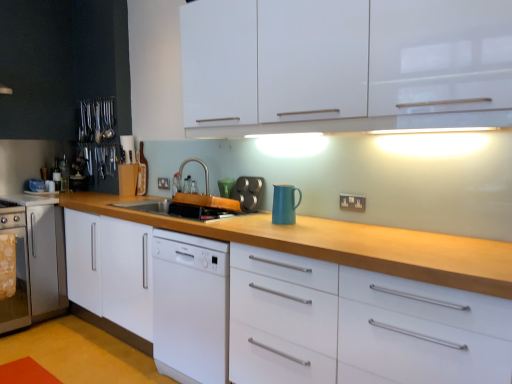
Identify the location of glossy ceramic pitcher at upper center. (284, 204).

Where is `white glossy cabinet at upper center`? white glossy cabinet at upper center is located at coordinates (344, 65).

Which object is more forward, glossy ceramic pitcher at upper center or white glossy cabinet at upper center?

Positioned in front is white glossy cabinet at upper center.

How different are the orientations of glossy ceramic pitcher at upper center and white glossy cabinet at upper center in degrees?

The angle between the facing direction of glossy ceramic pitcher at upper center and the facing direction of white glossy cabinet at upper center is 3.81 degrees.

Based on the photo, is glossy ceramic pitcher at upper center to the right of white glossy cabinet at upper center from the viewer's perspective?

No.

The width and height of the screenshot is (512, 384). Identify the location of cabinetry on the right of glossy ceramic pitcher at upper center. (x=344, y=65).

Based on the photo, is silver metallic faucet at center turned away from black plastic electrical outlet at center-right, which appears as the 2th electric outlet when viewed from the top?

No, black plastic electrical outlet at center-right, which appears as the 2th electric outlet when viewed from the top, is not at the back of silver metallic faucet at center.

Can you confirm if silver metallic faucet at center is wider than black plastic electrical outlet at center-right, which is counted as the 1th electric outlet, starting from the front?

Indeed, silver metallic faucet at center has a greater width compared to black plastic electrical outlet at center-right, which is counted as the 1th electric outlet, starting from the front.

Where is `tap located above the black plastic electrical outlet at center-right, acting as the first electric outlet starting from the right (from a real-world perspective)`? tap located above the black plastic electrical outlet at center-right, acting as the first electric outlet starting from the right (from a real-world perspective) is located at coordinates tap(203, 167).

Is silver metallic faucet at center bigger or smaller than black plastic electrical outlet at center-right, which appears as the 2th electric outlet when viewed from the top?

In the image, silver metallic faucet at center appears to be larger than black plastic electrical outlet at center-right, which appears as the 2th electric outlet when viewed from the top.

How many degrees apart are the facing directions of metallic silver muffin tin at center, acting as the second appliance starting from the left, and glossy ceramic pitcher at upper center?

metallic silver muffin tin at center, acting as the second appliance starting from the left, and glossy ceramic pitcher at upper center are facing 0.000119 degrees away from each other.

From the image's perspective, would you say metallic silver muffin tin at center, which is the first appliance in front-to-back order, is positioned over glossy ceramic pitcher at upper center?

Yes, from the image's perspective, metallic silver muffin tin at center, which is the first appliance in front-to-back order, is over glossy ceramic pitcher at upper center.

Looking at this image, considering the relative positions of metallic silver muffin tin at center, acting as the second appliance starting from the left, and glossy ceramic pitcher at upper center in the image provided, is metallic silver muffin tin at center, acting as the second appliance starting from the left, to the left or to the right of glossy ceramic pitcher at upper center?

Clearly, metallic silver muffin tin at center, acting as the second appliance starting from the left, is on the left of glossy ceramic pitcher at upper center in the image.

Is glossy ceramic pitcher at upper center at the back of metallic silver muffin tin at center, acting as the second appliance starting from the left?

No, metallic silver muffin tin at center, acting as the second appliance starting from the left,'s orientation is not away from glossy ceramic pitcher at upper center.

Considering the positions of objects silver metallic faucet at center and stainless steel oven at left, the 2th appliance in the right-to-left sequence, in the image provided, who is behind, silver metallic faucet at center or stainless steel oven at left, the 2th appliance in the right-to-left sequence,?

stainless steel oven at left, the 2th appliance in the right-to-left sequence, is behind.

Who is bigger, silver metallic faucet at center or stainless steel oven at left, the 2th appliance in the right-to-left sequence?

With larger size is stainless steel oven at left, the 2th appliance in the right-to-left sequence.

Is there a large distance between silver metallic faucet at center and stainless steel oven at left, arranged as the 2th appliance when viewed from the front?

Yes, silver metallic faucet at center is far from stainless steel oven at left, arranged as the 2th appliance when viewed from the front.

How many degrees apart are the facing directions of silver metallic faucet at center and stainless steel oven at left, arranged as the first appliance when viewed from the back?

93.8 degrees separate the facing orientations of silver metallic faucet at center and stainless steel oven at left, arranged as the first appliance when viewed from the back.

Does black plastic electric outlet at center, which is the 2th electric outlet from bottom to top, contain white glossy cabinet at upper center?

No, white glossy cabinet at upper center is not a part of black plastic electric outlet at center, which is the 2th electric outlet from bottom to top.

Is point (162, 184) positioned before point (342, 16)?

No, (162, 184) is further to viewer.

From the image's perspective, does black plastic electric outlet at center, the second electric outlet positioned from the right, appear lower than white glossy cabinet at upper center?

Yes, from the image's perspective, black plastic electric outlet at center, the second electric outlet positioned from the right, is below white glossy cabinet at upper center.

Does point (244, 189) appear closer or farther from the camera than point (169, 185)?

Point (244, 189) appears to be closer to the viewer than point (169, 185).

Is metallic silver muffin tin at center, acting as the second appliance starting from the left, positioned with its back to black plastic electric outlet at center, which ranks as the second electric outlet in front-to-back order?

metallic silver muffin tin at center, acting as the second appliance starting from the left, does not have its back to black plastic electric outlet at center, which ranks as the second electric outlet in front-to-back order.

Considering the sizes of metallic silver muffin tin at center, the 1th appliance viewed from the right, and black plastic electric outlet at center, which ranks as the first electric outlet in left-to-right order, in the image, is metallic silver muffin tin at center, the 1th appliance viewed from the right, bigger or smaller than black plastic electric outlet at center, which ranks as the first electric outlet in left-to-right order,?

metallic silver muffin tin at center, the 1th appliance viewed from the right, is bigger than black plastic electric outlet at center, which ranks as the first electric outlet in left-to-right order.

From the image's perspective, is metallic silver muffin tin at center, the 1th appliance viewed from the right, positioned above or below black plastic electric outlet at center, the second electric outlet positioned from the right?

Clearly, from the image's perspective, metallic silver muffin tin at center, the 1th appliance viewed from the right, is below black plastic electric outlet at center, the second electric outlet positioned from the right.

Is white glossy drawer at center aimed at glossy ceramic pitcher at upper center?

No.

Is white glossy drawer at center inside or outside of glossy ceramic pitcher at upper center?

white glossy drawer at center is located beyond the bounds of glossy ceramic pitcher at upper center.

Which of these two, white glossy drawer at center or glossy ceramic pitcher at upper center, is bigger?

white glossy drawer at center is bigger.

Which is in front, point (414, 307) or point (291, 201)?

Point (414, 307)

Find the location of `kitchen appliance below the white glossy cabinet at upper center (from the image's perspective)`. kitchen appliance below the white glossy cabinet at upper center (from the image's perspective) is located at coordinates (284, 204).

You are a GUI agent. You are given a task and a screenshot of the screen. Output one action in this format:
    pyautogui.click(x=<x>, y=<y>)
    Task: Click on the tap that is behind the black plastic electrical outlet at center-right, which is counted as the 1th electric outlet, starting from the front
    This screenshot has height=384, width=512.
    Given the screenshot: What is the action you would take?
    tap(203, 167)

From the image, which object appears to be nearer to metallic silver muffin tin at center, which ranks as the first appliance in top-to-bottom order, black plastic electric outlet at center, which is the 2th electric outlet from bottom to top, or glossy ceramic pitcher at upper center?

The object closer to metallic silver muffin tin at center, which ranks as the first appliance in top-to-bottom order, is glossy ceramic pitcher at upper center.

Looking at the image, which one is located closer to black plastic electrical outlet at center-right, which is counted as the 1th electric outlet, starting from the front, stainless steel oven at left, the 2th appliance in the right-to-left sequence, or white glossy drawer at center?

Among the two, white glossy drawer at center is located nearer to black plastic electrical outlet at center-right, which is counted as the 1th electric outlet, starting from the front.

Which object lies nearer to the anchor point white glossy drawer at center, metallic silver muffin tin at center, which appears as the second appliance when viewed from the back, or stainless steel oven at left, the first appliance when ordered from bottom to top?

metallic silver muffin tin at center, which appears as the second appliance when viewed from the back, is closer to white glossy drawer at center.

From the image, which object appears to be farther from silver metallic faucet at center, black plastic electrical outlet at center-right, which appears as the 2th electric outlet when viewed from the top, or glossy ceramic pitcher at upper center?

black plastic electrical outlet at center-right, which appears as the 2th electric outlet when viewed from the top, lies further to silver metallic faucet at center than the other object.

Looking at the image, which one is located closer to white glossy drawer at center, black plastic electrical outlet at center-right, which ranks as the second electric outlet in left-to-right order, or glossy ceramic pitcher at upper center?

The object closer to white glossy drawer at center is glossy ceramic pitcher at upper center.

Which object lies further to the anchor point silver metallic faucet at center, black plastic electrical outlet at center-right, acting as the first electric outlet starting from the right, or white glossy drawer at center?

white glossy drawer at center is positioned further to the anchor silver metallic faucet at center.

Based on their spatial positions, is black plastic electric outlet at center, positioned as the first electric outlet in top-to-bottom order, or glossy ceramic pitcher at upper center further from white glossy cabinet at upper center?

black plastic electric outlet at center, positioned as the first electric outlet in top-to-bottom order, is positioned further to the anchor white glossy cabinet at upper center.

When comparing their distances from white glossy cabinet at upper center, does silver metallic faucet at center or black plastic electric outlet at center, positioned as the first electric outlet in back-to-front order, seem further?

Among the two, black plastic electric outlet at center, positioned as the first electric outlet in back-to-front order, is located further to white glossy cabinet at upper center.

Identify the location of electric outlet positioned between glossy ceramic pitcher at upper center and black plastic electric outlet at center, positioned as the first electric outlet in back-to-front order, from near to far. (352, 202).

At what (x,y) coordinates should I click in order to perform the action: click on tap between stainless steel oven at left, the first appliance when ordered from bottom to top, and glossy ceramic pitcher at upper center, in the horizontal direction. Please return your answer as a coordinate pair (x, y). Looking at the image, I should click on coord(203,167).

In order to click on electric outlet positioned between white glossy drawer at center and silver metallic faucet at center from near to far in this screenshot , I will do `click(352, 202)`.

This screenshot has width=512, height=384. In order to click on appliance situated between black plastic electric outlet at center, the second electric outlet positioned from the right, and black plastic electrical outlet at center-right, the 2th electric outlet from the back, from left to right in this screenshot , I will do `click(248, 192)`.